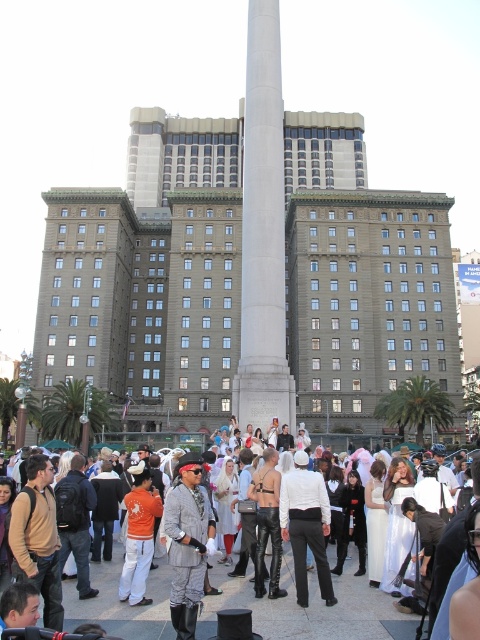
You are a photographer standing at the monument in front of the building. You want to take a photo that includes both the white marble column at center and the white matte pants at center. The minimum distance between them for the camera lens to focus properly is 70 feet. Can you capture both subjects in focus?

The white marble column at center is 75.90 feet from the white matte pants at center. Since the distance is more than the required 70 feet minimum, the camera can focus on both subjects.